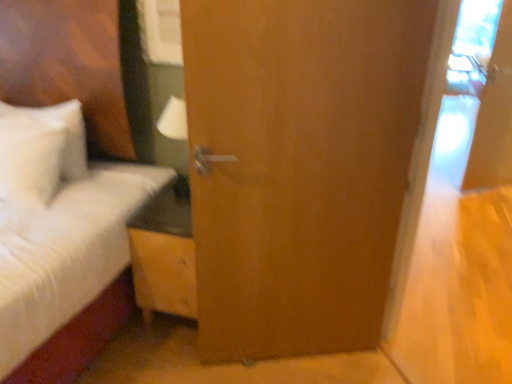
Question: Is white fluffy bed at left situated inside wooden door at center or outside?

Choices:
 (A) inside
 (B) outside

Answer: (B)

Question: Considering the positions of point (24, 127) and point (316, 192), is point (24, 127) closer or farther from the camera than point (316, 192)?

Choices:
 (A) closer
 (B) farther

Answer: (B)

Question: Which of these objects is positioned farthest from the wooden nightstand at center?

Choices:
 (A) white fluffy bed at left
 (B) wooden door at center

Answer: (B)

Question: Which of these objects is positioned closest to the white fluffy bed at left?

Choices:
 (A) wooden nightstand at center
 (B) wooden door at center

Answer: (A)